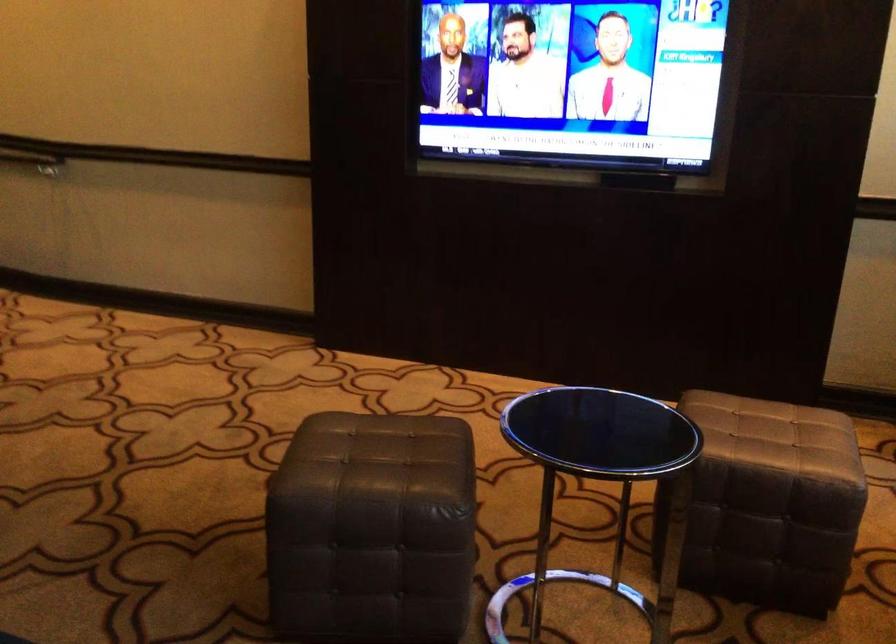
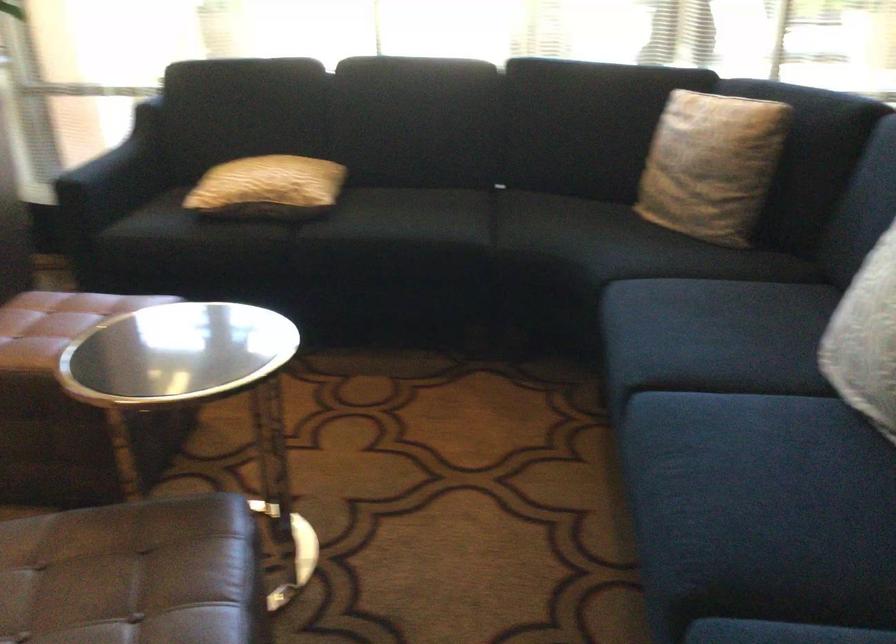
Find the pixel in the second image that matches the point at 376,462 in the first image.

(134, 574)